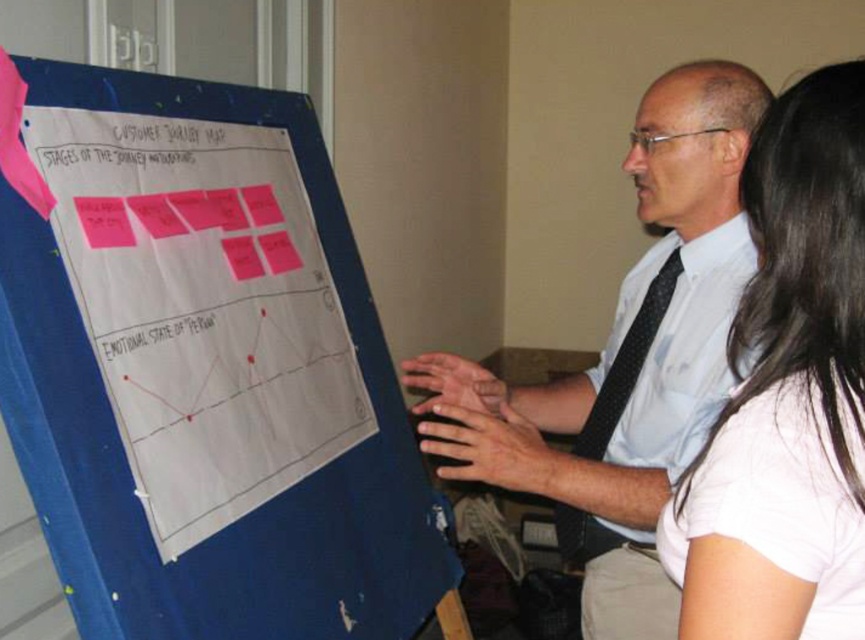
Is white matte shirt at upper right taller than black dotted tie at right?

No, white matte shirt at upper right is not taller than black dotted tie at right.

This screenshot has width=865, height=640. What do you see at coordinates (787, 394) in the screenshot?
I see `white matte shirt at upper right` at bounding box center [787, 394].

Between point (819, 518) and point (577, 531), which one is positioned in front?

Point (819, 518) is more forward.

Locate an element on the screen. The image size is (865, 640). white matte shirt at upper right is located at coordinates (787, 394).

Is blue fabric bulletin board at left thinner than white matte shirt at upper right?

No.

This screenshot has height=640, width=865. I want to click on blue fabric bulletin board at left, so click(202, 365).

Can you confirm if white shirt at center is positioned to the left of white matte shirt at upper right?

Yes, white shirt at center is to the left of white matte shirt at upper right.

Between point (663, 278) and point (774, 550), which one is positioned behind?

Positioned behind is point (663, 278).

Is point (737, 129) closer to camera compared to point (676, 548)?

No.

Where is `white shirt at center`? This screenshot has height=640, width=865. white shirt at center is located at coordinates [x=626, y=360].